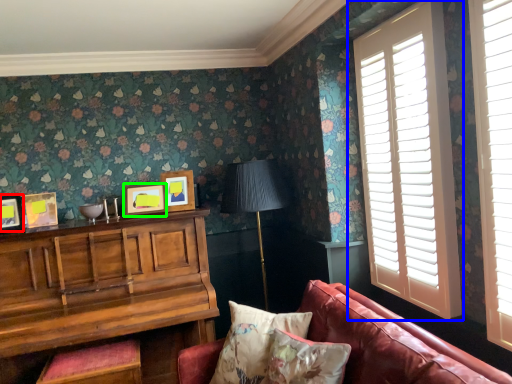
Question: Which object is the closest to the picture frame (highlighted by a red box)? Choose among these: window (highlighted by a blue box) or picture frame (highlighted by a green box).

Choices:
 (A) window
 (B) picture frame

Answer: (B)